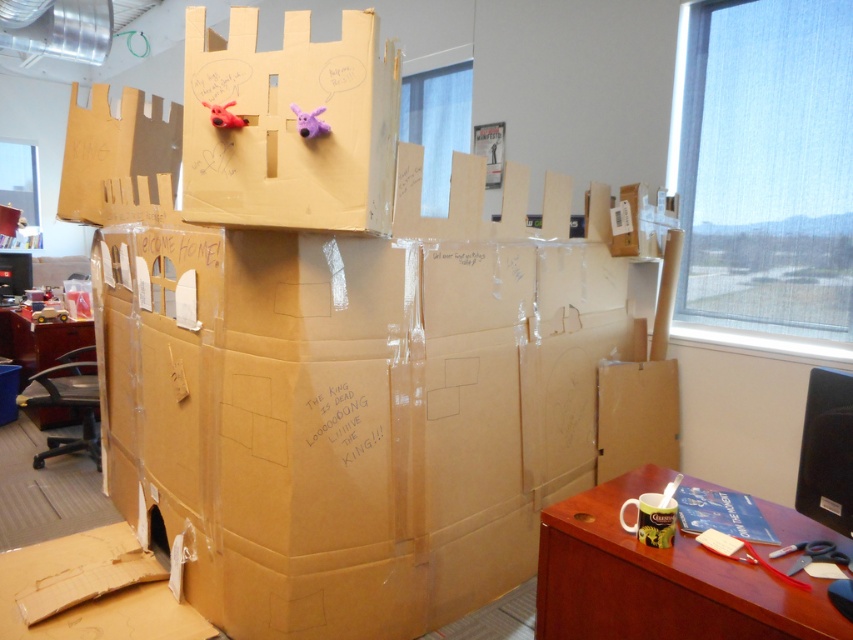
Is brown cardboard box at center to the right of wooden desk at lower right from the viewer's perspective?

Incorrect, brown cardboard box at center is not on the right side of wooden desk at lower right.

Between brown cardboard box at center and wooden desk at lower right, which one has less height?

With less height is wooden desk at lower right.

Between point (357, 138) and point (572, 509), which one is positioned in front?

Positioned in front is point (357, 138).

Locate an element on the screen. brown cardboard box at center is located at coordinates (289, 125).

From the picture: Is brown cardboard box at center positioned in front of matte brown table at lower left?

Yes.

Measure the distance from brown cardboard box at center to matte brown table at lower left.

brown cardboard box at center is 11.51 feet away from matte brown table at lower left.

Does point (306, 97) lie in front of point (33, 356)?

Yes.

Where is `brown cardboard box at center`? brown cardboard box at center is located at coordinates (289, 125).

Which is below, wooden desk at lower right or matte brown table at lower left?

wooden desk at lower right

The image size is (853, 640). What do you see at coordinates (659, 580) in the screenshot?
I see `wooden desk at lower right` at bounding box center [659, 580].

Measure the distance between wooden desk at lower right and camera.

They are 1.26 meters apart.

Where is `wooden desk at lower right`? This screenshot has height=640, width=853. wooden desk at lower right is located at coordinates (659, 580).